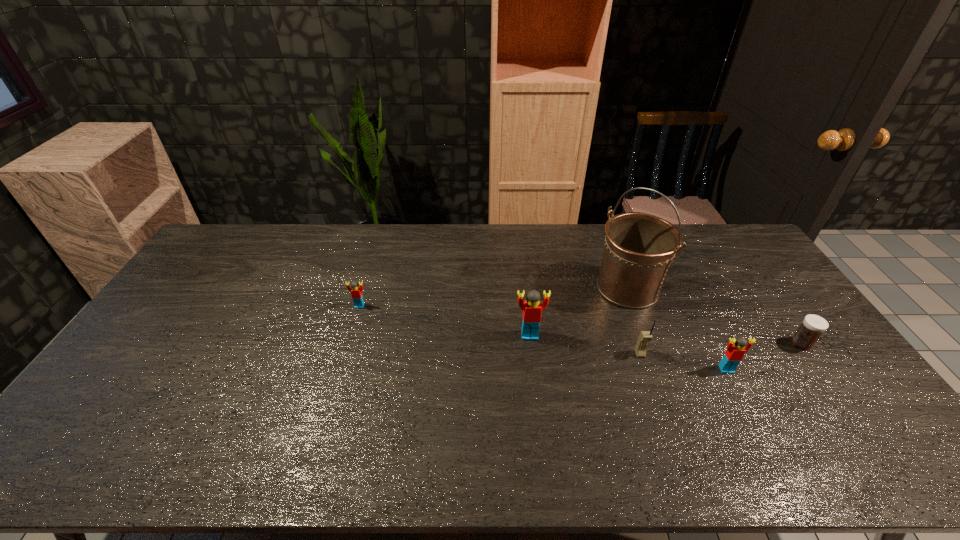
You are a GUI agent. You are given a task and a screenshot of the screen. Output one action in this format:
    pyautogui.click(x=<x>, y=<y>)
    Task: Click on the vacant region at the far right corner
    
    Given the screenshot: What is the action you would take?
    716,248

At what (x,y) coordinates should I click in order to perform the action: click on free space that is in between the tallest Lego and the leftmost object. Please return your answer as a coordinate pair (x, y). Looking at the image, I should click on (444, 321).

This screenshot has width=960, height=540. Find the location of `free space between the cellular telephone and the farthest Lego`. free space between the cellular telephone and the farthest Lego is located at coordinates (499, 330).

What are the coordinates of `vacant space in between the second tallest Lego and the shortest Lego` in the screenshot? It's located at (543, 338).

I want to click on vacant space that is in between the rightmost object and the cellular telephone, so click(x=721, y=349).

You are a GUI agent. You are given a task and a screenshot of the screen. Output one action in this format:
    pyautogui.click(x=<x>, y=<y>)
    Task: Click on the vacant space that's between the second Lego from left to right and the second tallest Lego
    The height and width of the screenshot is (540, 960).
    Given the screenshot: What is the action you would take?
    pyautogui.click(x=628, y=352)

This screenshot has width=960, height=540. I want to click on free space that is in between the leftmost Lego and the cellular telephone, so click(x=499, y=330).

Locate an element on the screen. This screenshot has height=540, width=960. vacant space that's between the rightmost Lego and the medicine is located at coordinates coord(764,356).

You are a GUI agent. You are given a task and a screenshot of the screen. Output one action in this format:
    pyautogui.click(x=<x>, y=<y>)
    Task: Click on the vacant space that is in between the rightmost object and the nearest Lego
    The image size is (960, 540).
    Given the screenshot: What is the action you would take?
    click(764, 356)

At what (x,y) coordinates should I click in order to perform the action: click on empty location between the second tallest Lego and the cellular telephone. Please return your answer as a coordinate pair (x, y). This screenshot has width=960, height=540. Looking at the image, I should click on (684, 362).